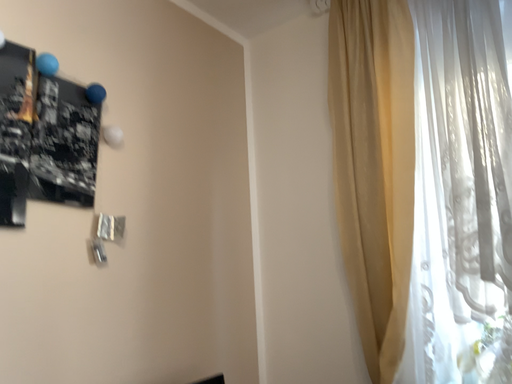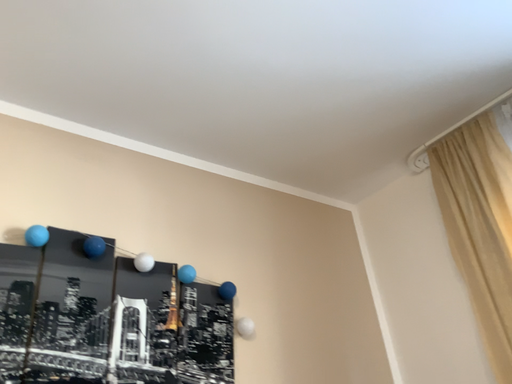
Question: Which way did the camera rotate in the video?

Choices:
 (A) rotated upward
 (B) rotated downward

Answer: (A)